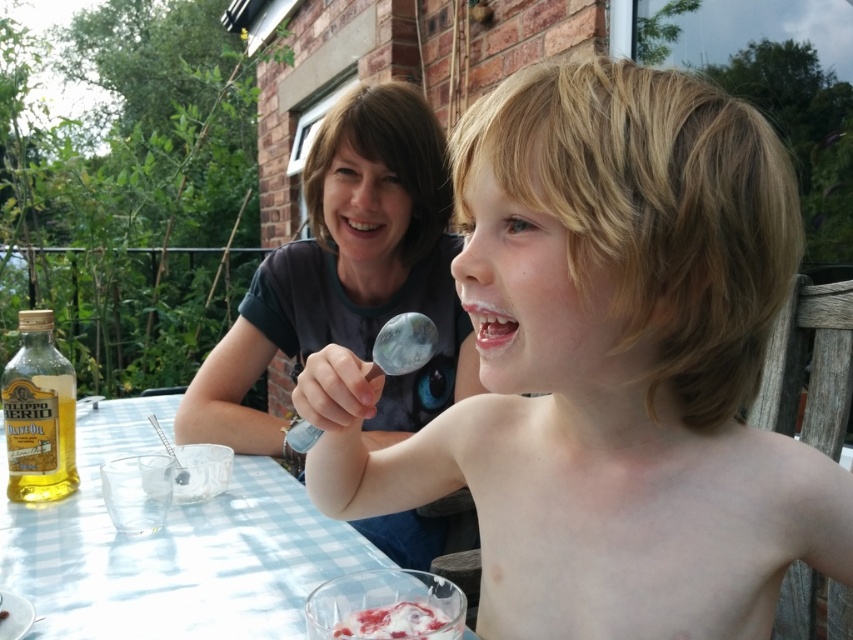
Is smooth blonde hair at center shorter than light blue checkered tablecloth at center?

A: No.

Which is behind, point (653, 291) or point (146, 561)?

The point (146, 561) is behind.

Who is more distant from viewer, (740, 508) or (80, 438)?

The point (80, 438) is more distant.

Identify the location of smooth blonde hair at center. Image resolution: width=853 pixels, height=640 pixels. pos(608,365).

Who is taller, dark gray t-shirt at upper center or white creamy dessert at lower center?

With more height is dark gray t-shirt at upper center.

This screenshot has width=853, height=640. In order to click on dark gray t-shirt at upper center in this screenshot , I will do `click(350, 276)`.

Does smooth blonde hair at center appear on the right side of golden olive oil at lower left?

Yes, smooth blonde hair at center is to the right of golden olive oil at lower left.

Who is positioned more to the left, smooth blonde hair at center or golden olive oil at lower left?

Positioned to the left is golden olive oil at lower left.

What do you see at coordinates (608, 365) in the screenshot? I see `smooth blonde hair at center` at bounding box center [608, 365].

You are a GUI agent. You are given a task and a screenshot of the screen. Output one action in this format:
    pyautogui.click(x=<x>, y=<y>)
    Task: Click on the smooth blonde hair at center
    This screenshot has width=853, height=640.
    Given the screenshot: What is the action you would take?
    pyautogui.click(x=608, y=365)